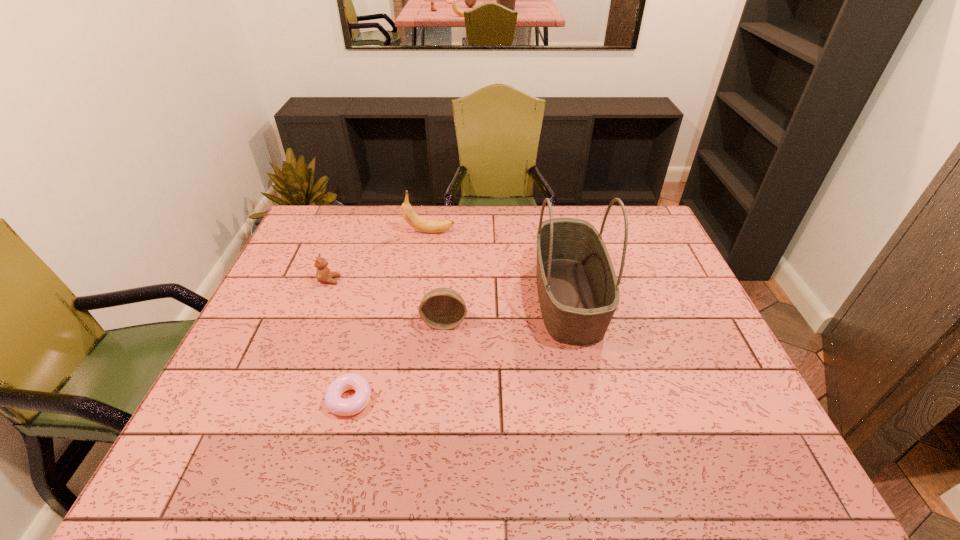
In the image, there is a desktop. Where is `vacant space at the far left corner`? This screenshot has height=540, width=960. vacant space at the far left corner is located at coordinates click(345, 228).

Identify the location of vacant region at the near left corner of the desktop. The image size is (960, 540). (192, 482).

Find the location of a particular element. The image size is (960, 540). free area in between the fourth shortest object and the second shortest object is located at coordinates (379, 256).

You are a GUI agent. You are given a task and a screenshot of the screen. Output one action in this format:
    pyautogui.click(x=<x>, y=<y>)
    Task: Click on the vacant space that's between the shortest object and the third tallest object
    The image size is (960, 540).
    Given the screenshot: What is the action you would take?
    pyautogui.click(x=397, y=361)

In order to click on empty space that is in between the third tallest object and the rightmost object in this screenshot , I will do `click(507, 309)`.

Identify the location of empty location between the doughnut and the basket. This screenshot has height=540, width=960. (460, 348).

At what (x,y) coordinates should I click in order to perform the action: click on unoccupied area between the second shortest object and the bowl. Please return your answer as a coordinate pair (x, y). This screenshot has width=960, height=540. Looking at the image, I should click on point(387,301).

I want to click on vacant point located between the shortest object and the teddy bear, so click(x=340, y=340).

Where is `free space between the nearest object and the banana`? free space between the nearest object and the banana is located at coordinates (390, 315).

I want to click on free space between the leftmost object and the farthest object, so click(379, 256).